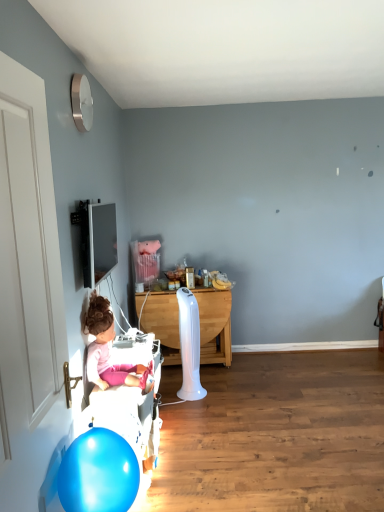
The height and width of the screenshot is (512, 384). Describe the element at coordinates (98, 473) in the screenshot. I see `blue glossy balloon at lower left` at that location.

Find the location of a particular element. white fabric bed frame at lower left is located at coordinates (131, 406).

This screenshot has width=384, height=512. What do you see at coordinates (131, 406) in the screenshot?
I see `white fabric bed frame at lower left` at bounding box center [131, 406].

Identify the location of white wood table at center. (214, 325).

Does white fabric bed frame at lower left have a larger size compared to white wood table at center?

Actually, white fabric bed frame at lower left might be smaller than white wood table at center.

The height and width of the screenshot is (512, 384). What are the coordinates of `table on the right of white fabric bed frame at lower left` in the screenshot? It's located at (214, 325).

Is white fabric bed frame at lower left further to the viewer compared to white wood table at center?

No.

Can we say white wood table at center lies outside white fabric bed frame at lower left?

Yes, white wood table at center is located beyond the bounds of white fabric bed frame at lower left.

From the image's perspective, between white wood table at center and white fabric bed frame at lower left, who is located below?

white fabric bed frame at lower left.

Is white wood table at center not near white fabric bed frame at lower left?

Actually, white wood table at center and white fabric bed frame at lower left are a little close together.

Can you confirm if white wood table at center is shorter than white fabric bed frame at lower left?

No.

Visually, is pink fabric doll at lower left positioned to the left or to the right of white fabric bed frame at lower left?

Based on their positions, pink fabric doll at lower left is located to the left of white fabric bed frame at lower left.

Is pink fabric doll at lower left situated inside white fabric bed frame at lower left or outside?

The correct answer is: outside.

From a real-world perspective, is pink fabric doll at lower left under white fabric bed frame at lower left?

No, from a real-world perspective, pink fabric doll at lower left is not under white fabric bed frame at lower left.

Is blue glossy balloon at lower left turned away from white fabric bed frame at lower left?

blue glossy balloon at lower left is not turned away from white fabric bed frame at lower left.

From a real-world perspective, which object stands above the other?

blue glossy balloon at lower left, from a real-world perspective.

Can you confirm if blue glossy balloon at lower left is thinner than white fabric bed frame at lower left?

Indeed, blue glossy balloon at lower left has a lesser width compared to white fabric bed frame at lower left.

Considering the relative sizes of blue glossy balloon at lower left and white fabric bed frame at lower left in the image provided, is blue glossy balloon at lower left smaller than white fabric bed frame at lower left?

Indeed, blue glossy balloon at lower left has a smaller size compared to white fabric bed frame at lower left.

Between point (96, 313) and point (109, 441), which one is positioned behind?

The point (96, 313) is farther.

Is pink fabric doll at lower left situated inside blue glossy balloon at lower left or outside?

pink fabric doll at lower left is located beyond the bounds of blue glossy balloon at lower left.

Is pink fabric doll at lower left facing away from blue glossy balloon at lower left?

No, pink fabric doll at lower left is not facing the opposite direction of blue glossy balloon at lower left.

At what (x,y) coordinates should I click in order to perform the action: click on balloon that appears on the right of pink fabric doll at lower left. Please return your answer as a coordinate pair (x, y). This screenshot has height=512, width=384. Looking at the image, I should click on (98, 473).

Is white fabric bed frame at lower left positioned behind blue glossy balloon at lower left?

Yes, the depth of white fabric bed frame at lower left is greater than that of blue glossy balloon at lower left.

Is white fabric bed frame at lower left oriented away from blue glossy balloon at lower left?

No, blue glossy balloon at lower left is not at the back of white fabric bed frame at lower left.

Does white fabric bed frame at lower left have a greater width compared to blue glossy balloon at lower left?

Yes.

Is pink fabric doll at lower left at the back of white wood table at center?

No, white wood table at center is not facing the opposite direction of pink fabric doll at lower left.

Is white wood table at center next to pink fabric doll at lower left and touching it?

They are not placed beside each other.

Which of these two, white wood table at center or pink fabric doll at lower left, is smaller?

With smaller size is pink fabric doll at lower left.

Can you confirm if white wood table at center is wider than pink fabric doll at lower left?

Yes, white wood table at center is wider than pink fabric doll at lower left.

Identify the location of bed frame below the white wood table at center (from the image's perspective). The image size is (384, 512). (131, 406).

Locate an element on the screen. table that is above the white fabric bed frame at lower left (from the image's perspective) is located at coordinates (214, 325).

Looking at the image, which one is located further to pink fabric doll at lower left, blue glossy balloon at lower left or white fabric bed frame at lower left?

Based on the image, blue glossy balloon at lower left appears to be further to pink fabric doll at lower left.

From the image, which object appears to be farther from pink fabric doll at lower left, white fabric bed frame at lower left or white wood table at center?

white wood table at center is positioned further to the anchor pink fabric doll at lower left.

When comparing their distances from white wood table at center, does white fabric bed frame at lower left or pink fabric doll at lower left seem closer?

Based on the image, white fabric bed frame at lower left appears to be nearer to white wood table at center.

From the image, which object appears to be farther from blue glossy balloon at lower left, pink fabric doll at lower left or white fabric bed frame at lower left?

pink fabric doll at lower left is further to blue glossy balloon at lower left.

Considering their positions, is white wood table at center positioned closer to pink fabric doll at lower left than white fabric bed frame at lower left?

white fabric bed frame at lower left.

From the image, which object appears to be nearer to blue glossy balloon at lower left, white fabric bed frame at lower left or pink fabric doll at lower left?

white fabric bed frame at lower left is closer to blue glossy balloon at lower left.

Based on their spatial positions, is white wood table at center or white fabric bed frame at lower left closer to blue glossy balloon at lower left?

white fabric bed frame at lower left is positioned closer to the anchor blue glossy balloon at lower left.

Considering their positions, is blue glossy balloon at lower left positioned further to white fabric bed frame at lower left than white wood table at center?

Based on the image, white wood table at center appears to be further to white fabric bed frame at lower left.

The width and height of the screenshot is (384, 512). Find the location of `bed frame between blue glossy balloon at lower left and white wood table at center in the front-back direction`. bed frame between blue glossy balloon at lower left and white wood table at center in the front-back direction is located at coordinates (131, 406).

At what (x,y) coordinates should I click in order to perform the action: click on person between blue glossy balloon at lower left and white fabric bed frame at lower left from front to back. Please return your answer as a coordinate pair (x, y). The height and width of the screenshot is (512, 384). Looking at the image, I should click on [x=107, y=351].

At what (x,y) coordinates should I click in order to perform the action: click on bed frame positioned between pink fabric doll at lower left and white wood table at center from near to far. Please return your answer as a coordinate pair (x, y). This screenshot has width=384, height=512. Looking at the image, I should click on [131, 406].

Where is `person between blue glossy balloon at lower left and white wood table at center along the z-axis`? person between blue glossy balloon at lower left and white wood table at center along the z-axis is located at coordinates (107, 351).